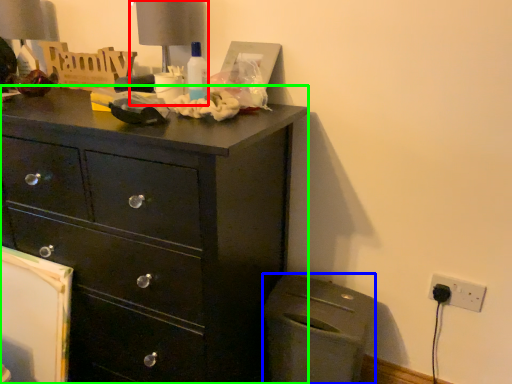
Question: Which object is the closest to the table lamp (highlighted by a red box)? Choose among these: cabinetry (highlighted by a blue box) or chest of drawers (highlighted by a green box).

Choices:
 (A) cabinetry
 (B) chest of drawers

Answer: (B)